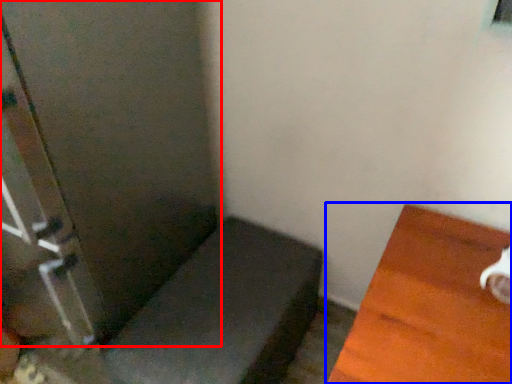
Question: Which of the following is the closest to the observer, screen door (highlighted by a red box) or furniture (highlighted by a blue box)?

Choices:
 (A) screen door
 (B) furniture

Answer: (B)